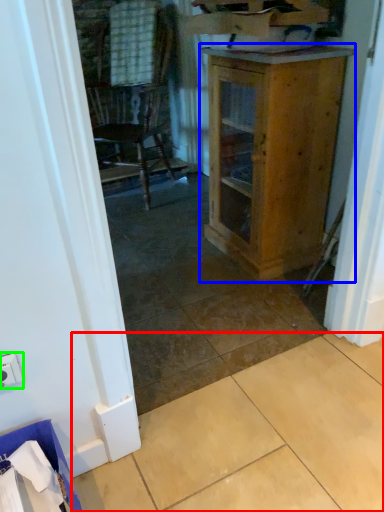
Question: Which is nearer to the tile (highlighted by a red box)? cabinetry (highlighted by a blue box) or electric outlet (highlighted by a green box).

Choices:
 (A) cabinetry
 (B) electric outlet

Answer: (B)